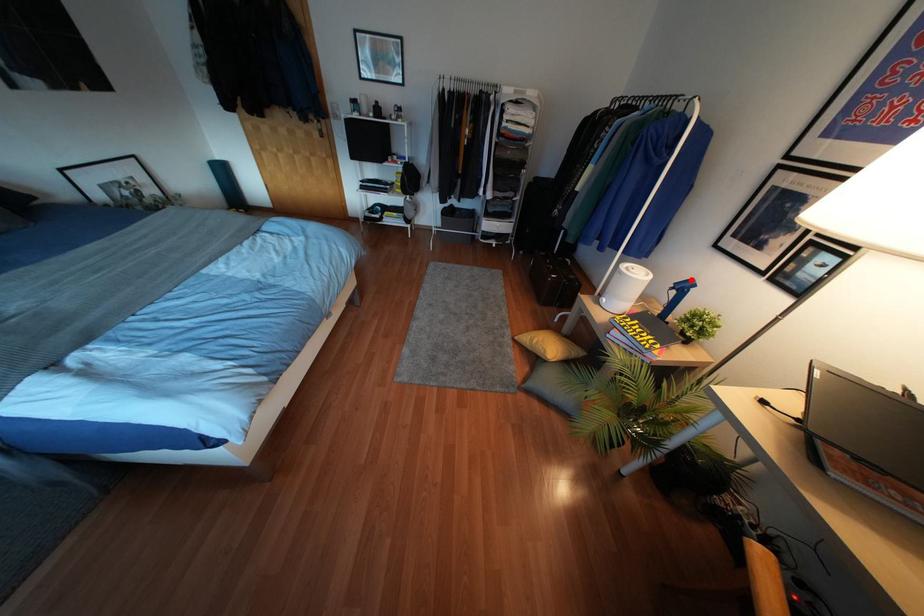
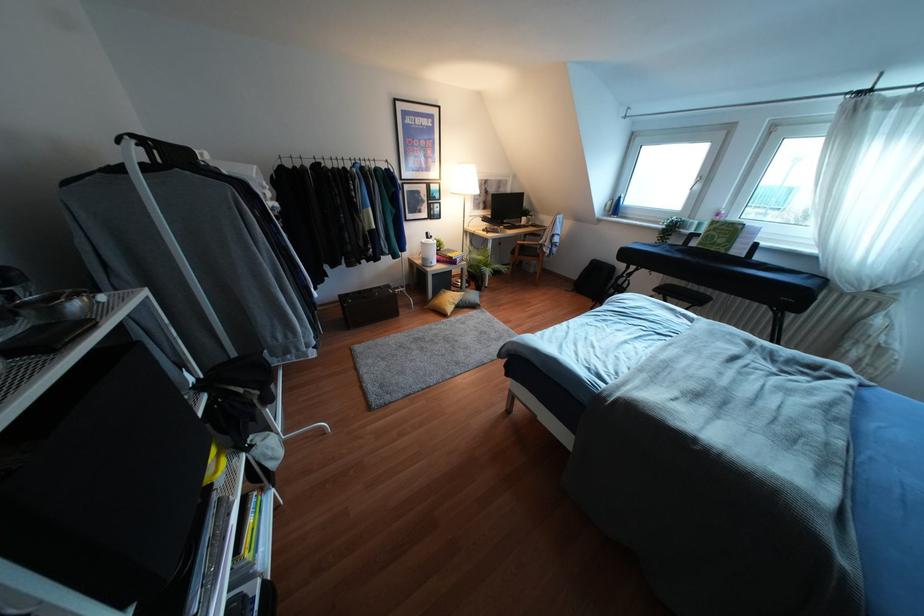
In the second image, find the point that corresponds to the highlighted location in the first image.

(427, 233)